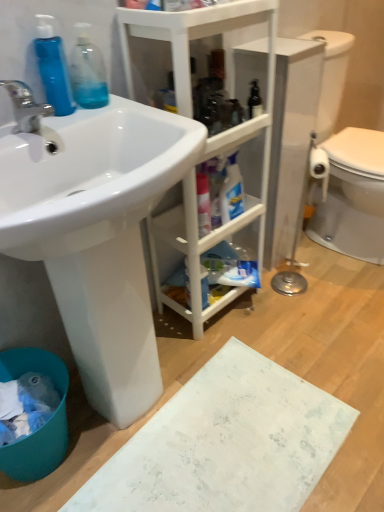
This screenshot has width=384, height=512. Describe the element at coordinates (88, 71) in the screenshot. I see `transparent plastic bottle at upper left, the 2th cleaning product when ordered from left to right` at that location.

Locate an element on the screen. The image size is (384, 512). white matte cabinet at center is located at coordinates click(x=209, y=137).

I want to click on blue plastic bottle at left, the first cleaning product when ordered from left to right, so 53,67.

From a real-world perspective, which object rests below the other?

white matte cabinet at center, from a real-world perspective.

Are blue plastic bottle at left, which appears as the second cleaning product when viewed from the right, and white matte cabinet at center far apart?

blue plastic bottle at left, which appears as the second cleaning product when viewed from the right, is actually quite close to white matte cabinet at center.

Which is correct: blue plastic bottle at left, the first cleaning product when ordered from left to right, is inside white matte cabinet at center, or outside of it?

blue plastic bottle at left, the first cleaning product when ordered from left to right, lies outside white matte cabinet at center.

From the picture: Considering the relative positions of blue plastic bucket at lower left and white glossy sink at upper left in the image provided, is blue plastic bucket at lower left to the left or to the right of white glossy sink at upper left?

From the image, it's evident that blue plastic bucket at lower left is to the left of white glossy sink at upper left.

From the image's perspective, which is below, blue plastic bucket at lower left or white glossy sink at upper left?

blue plastic bucket at lower left, from the image's perspective.

Is blue plastic bucket at lower left shorter than white glossy sink at upper left?

Correct, blue plastic bucket at lower left is not as tall as white glossy sink at upper left.

Which of these two, blue plastic bucket at lower left or white glossy sink at upper left, is thinner?

With smaller width is blue plastic bucket at lower left.

Is point (87, 86) farther from viewer compared to point (60, 157)?

Yes, it is behind point (60, 157).

Is transparent plastic bottle at upper left, the 1th cleaning product positioned from the right, beside white glossy sink at upper left?

There is a gap between transparent plastic bottle at upper left, the 1th cleaning product positioned from the right, and white glossy sink at upper left.

Considering the sizes of objects transparent plastic bottle at upper left, the 2th cleaning product when ordered from left to right, and white glossy sink at upper left in the image provided, who is shorter, transparent plastic bottle at upper left, the 2th cleaning product when ordered from left to right, or white glossy sink at upper left?

transparent plastic bottle at upper left, the 2th cleaning product when ordered from left to right.

Do you think matte silver faucet at left is within white glossy sink at upper left, or outside of it?

matte silver faucet at left exists outside the volume of white glossy sink at upper left.

From the image's perspective, which object appears higher, matte silver faucet at left or white glossy sink at upper left?

matte silver faucet at left.

From a real-world perspective, is matte silver faucet at left positioned over white glossy sink at upper left based on gravity?

Yes, from a real-world perspective, matte silver faucet at left is over white glossy sink at upper left

Is blue plastic bucket at lower left positioned beyond the bounds of white matte cabinet at center?

Yes, blue plastic bucket at lower left is located beyond the bounds of white matte cabinet at center.

Does point (25, 479) come behind point (182, 60)?

Yes, it is.

Does blue plastic bucket at lower left appear on the left side of white matte cabinet at center?

Yes, blue plastic bucket at lower left is to the left of white matte cabinet at center.

From a real-world perspective, is white glossy sink at upper left positioned above or below white matte cabinet at center?

white glossy sink at upper left is below white matte cabinet at center.

Between white glossy sink at upper left and white matte cabinet at center, which one has more height?

white matte cabinet at center is taller.

Where is `sink on the left of white matte cabinet at center`? Image resolution: width=384 pixels, height=512 pixels. sink on the left of white matte cabinet at center is located at coordinates (97, 234).

From a real-world perspective, between transparent plastic bottle at upper left, the 1th cleaning product positioned from the right, and blue plastic bottle at left, the first cleaning product when ordered from left to right, who is vertically higher?

blue plastic bottle at left, the first cleaning product when ordered from left to right.

Choose the correct answer: Is transparent plastic bottle at upper left, the 1th cleaning product positioned from the right, inside blue plastic bottle at left, the first cleaning product when ordered from left to right, or outside it?

transparent plastic bottle at upper left, the 1th cleaning product positioned from the right, is not enclosed by blue plastic bottle at left, the first cleaning product when ordered from left to right.

In the scene shown: How much distance is there between transparent plastic bottle at upper left, the 2th cleaning product when ordered from left to right, and blue plastic bottle at left, which appears as the second cleaning product when viewed from the right?

A distance of 2.35 inches exists between transparent plastic bottle at upper left, the 2th cleaning product when ordered from left to right, and blue plastic bottle at left, which appears as the second cleaning product when viewed from the right.

Are transparent plastic bottle at upper left, the 1th cleaning product positioned from the right, and blue plastic bottle at left, the first cleaning product when ordered from left to right, beside each other?

Yes, transparent plastic bottle at upper left, the 1th cleaning product positioned from the right, is right next to blue plastic bottle at left, the first cleaning product when ordered from left to right, and making contact.

From the white matte cabinet at center, count the 2nd cleaning product to the left and point to it. Please provide its 2D coordinates.

[(53, 67)]

Find the location of a particular element. The width and height of the screenshot is (384, 512). toilet bowl that is behind the white glossy sink at upper left is located at coordinates (43, 425).

Considering their positions, is matte silver faucet at left positioned further to transparent plastic bottle at upper left, the 2th cleaning product when ordered from left to right, than white glossy sink at upper left?

white glossy sink at upper left is positioned further to the anchor transparent plastic bottle at upper left, the 2th cleaning product when ordered from left to right.

Based on their spatial positions, is blue plastic bucket at lower left or blue plastic bottle at left, the first cleaning product when ordered from left to right, further from transparent plastic bottle at upper left, the 2th cleaning product when ordered from left to right?

blue plastic bucket at lower left.

Looking at the image, which one is located further to white glossy sink at upper left, blue plastic bottle at left, the first cleaning product when ordered from left to right, or white matte cabinet at center?

blue plastic bottle at left, the first cleaning product when ordered from left to right.

Based on their spatial positions, is white matte cabinet at center or blue plastic bucket at lower left further from transparent plastic bottle at upper left, the 1th cleaning product positioned from the right?

Based on the image, blue plastic bucket at lower left appears to be further to transparent plastic bottle at upper left, the 1th cleaning product positioned from the right.

Looking at the image, which one is located closer to transparent plastic bottle at upper left, the 1th cleaning product positioned from the right, blue plastic bucket at lower left or matte silver faucet at left?

matte silver faucet at left is closer to transparent plastic bottle at upper left, the 1th cleaning product positioned from the right.

Considering their positions, is matte silver faucet at left positioned further to blue plastic bottle at left, which appears as the second cleaning product when viewed from the right, than blue plastic bucket at lower left?

The object further to blue plastic bottle at left, which appears as the second cleaning product when viewed from the right, is blue plastic bucket at lower left.

Considering their positions, is white matte cabinet at center positioned closer to transparent plastic bottle at upper left, the 2th cleaning product when ordered from left to right, than matte silver faucet at left?

matte silver faucet at left.

When comparing their distances from matte silver faucet at left, does white glossy sink at upper left or blue plastic bottle at left, which appears as the second cleaning product when viewed from the right, seem closer?

Based on the image, blue plastic bottle at left, which appears as the second cleaning product when viewed from the right, appears to be nearer to matte silver faucet at left.

Where is `cleaning product between transparent plastic bottle at upper left, the 1th cleaning product positioned from the right, and white glossy sink at upper left, in the vertical direction`? cleaning product between transparent plastic bottle at upper left, the 1th cleaning product positioned from the right, and white glossy sink at upper left, in the vertical direction is located at coordinates (53, 67).

The image size is (384, 512). Identify the location of cleaning product between transparent plastic bottle at upper left, the 1th cleaning product positioned from the right, and matte silver faucet at left, in the vertical direction. tap(53, 67).

At what (x,y) coordinates should I click in order to perform the action: click on tap between transparent plastic bottle at upper left, the 1th cleaning product positioned from the right, and blue plastic bucket at lower left in the up-down direction. Please return your answer as a coordinate pair (x, y). Looking at the image, I should click on (25, 106).

This screenshot has width=384, height=512. I want to click on sink that lies between blue plastic bottle at left, the first cleaning product when ordered from left to right, and blue plastic bucket at lower left from top to bottom, so click(97, 234).